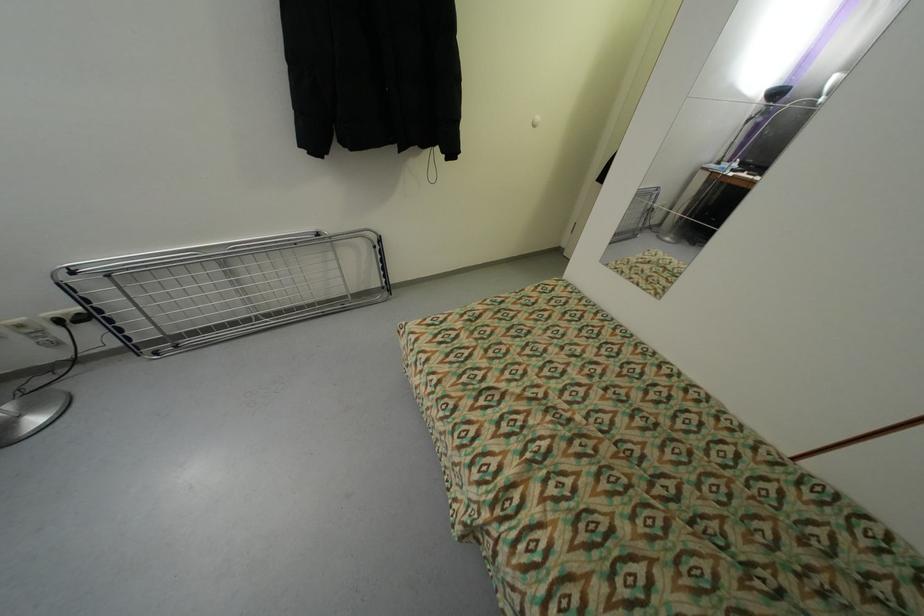
Where would you pull the jacket drawstring? Please return your answer as a coordinate pair (x, y).

(372, 74)